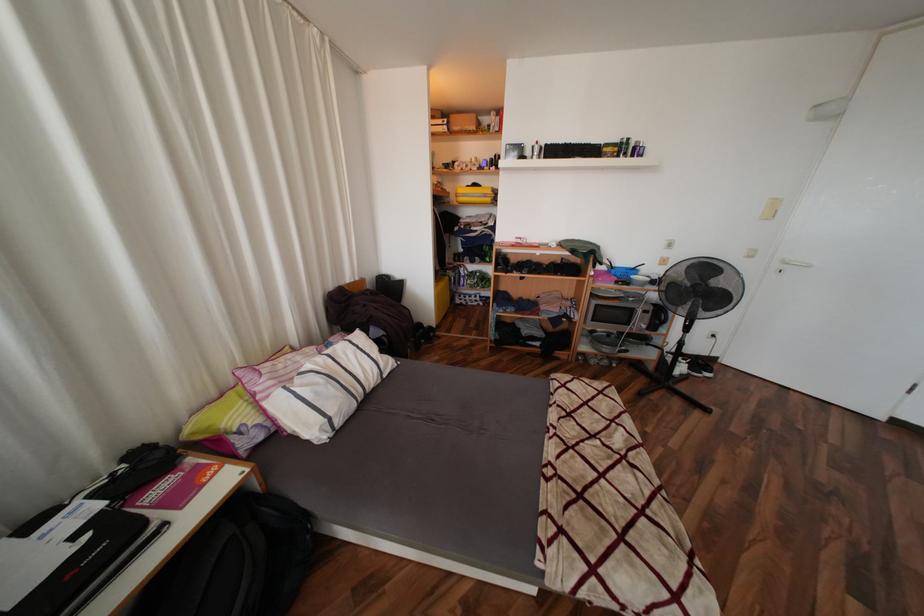
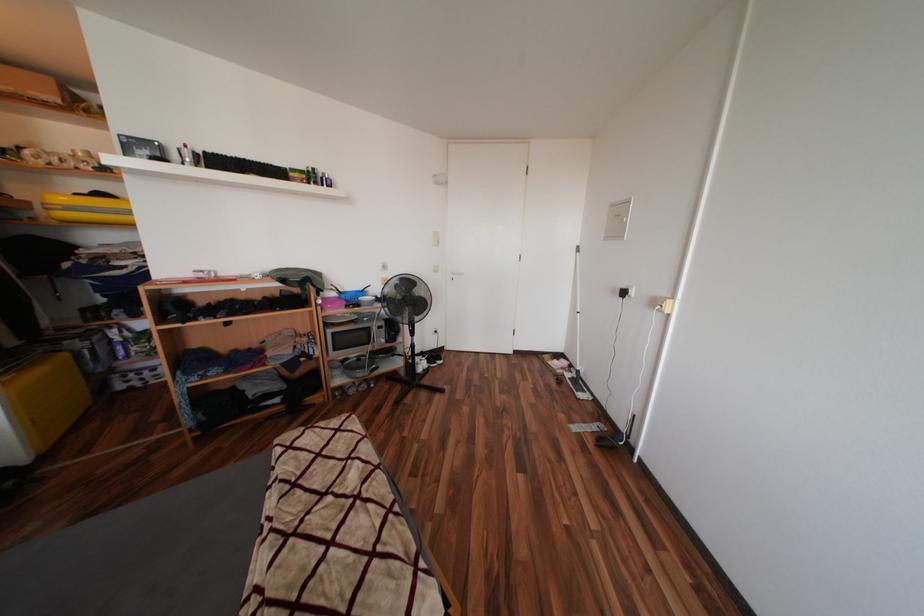
Question: Based on the continuous images, in which direction is the camera rotating? Reply with the corresponding letter.

Choices:
 (A) Left
 (B) Right
 (C) Up
 (D) Down

Answer: (B)